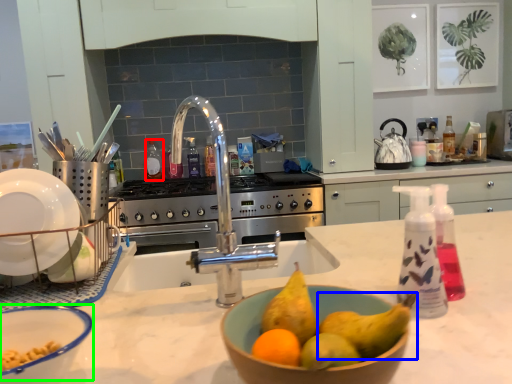
Question: Considering the real-world distances, which object is closest to bottle (highlighted by a red box)? pear (highlighted by a blue box) or basin (highlighted by a green box).

Choices:
 (A) pear
 (B) basin

Answer: (B)